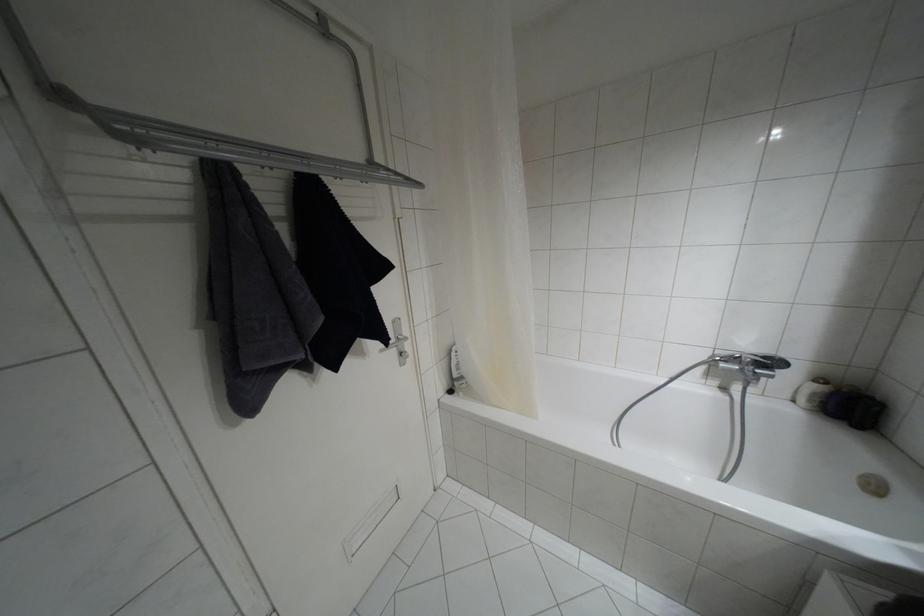
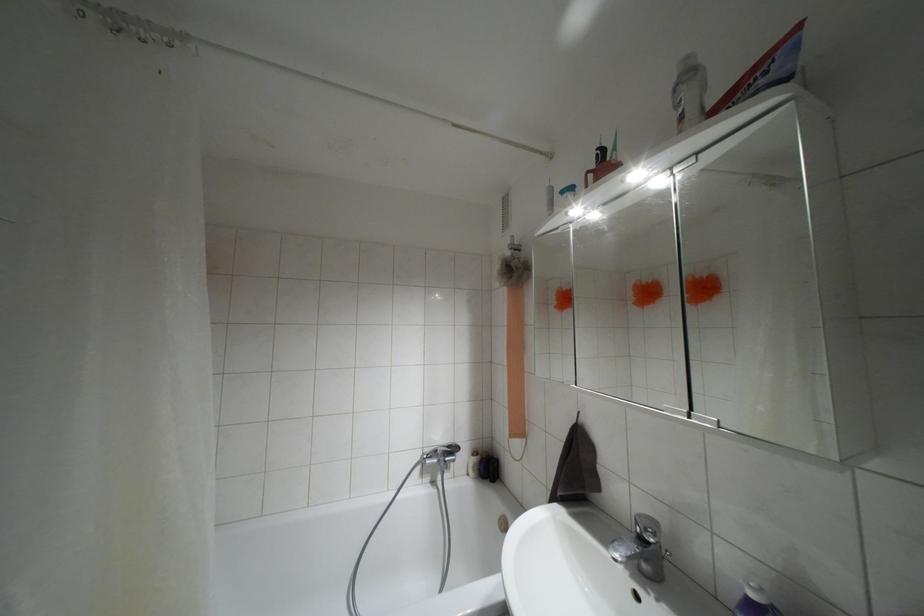
In the second image, find the point that corresponds to pixel 763 357 in the first image.

(447, 446)